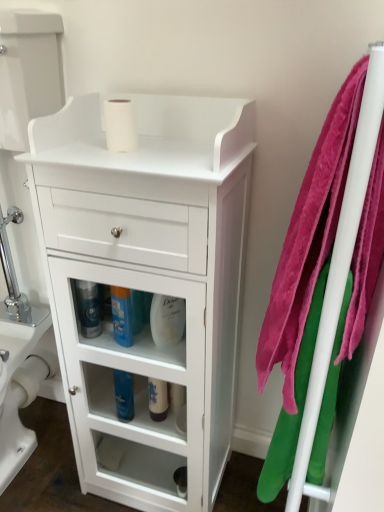
Question: In the image, is white glossy bottle at center, the second cleaning product positioned from the right, on the left side or the right side of blue glossy bottle at lower center, the second cleaning product positioned from the left?

Choices:
 (A) left
 (B) right

Answer: (B)

Question: From the image's perspective, is white glossy bottle at center, the second cleaning product positioned from the right, positioned above or below blue glossy bottle at lower center, the second cleaning product positioned from the left?

Choices:
 (A) below
 (B) above

Answer: (A)

Question: Based on their relative distances, which object is farther from the velvety pink towel at right, which is counted as the second bath towel, starting from the right?

Choices:
 (A) pink plush towel at right, which is the 2th bath towel in left-to-right order
 (B) white matte toilet paper at lower center, arranged as the second toilet paper when viewed from the front
 (C) white glossy cabinet at center
 (D) blue glossy bottle at center, which is counted as the 3th cleaning product, starting from the right
 (E) blue glossy bottle at lower center, the second cleaning product positioned from the left

Answer: (B)

Question: Estimate the real-world distances between objects in this image. Which object is farther from the blue glossy bottle at lower center, the second cleaning product positioned from the left?

Choices:
 (A) velvety pink towel at right, which is counted as the second bath towel, starting from the right
 (B) white glossy bottle at center, positioned as the 1th cleaning product in right-to-left order
 (C) white glossy cabinet at center
 (D) white matte toilet paper at lower center, placed as the first toilet paper when sorted from left to right
 (E) white glossy toilet bowl at lower left

Answer: (A)